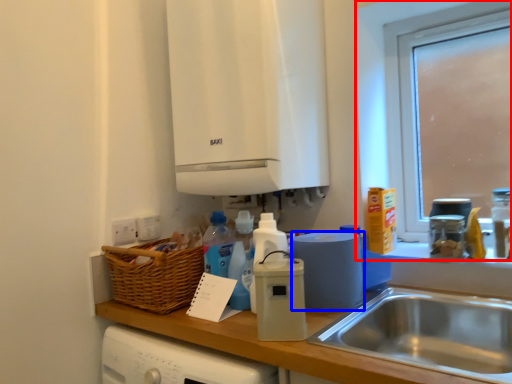
Question: Which object appears farthest to the camera in this image, window (highlighted by a red box) or kitchen appliance (highlighted by a blue box)?

Choices:
 (A) window
 (B) kitchen appliance

Answer: (A)